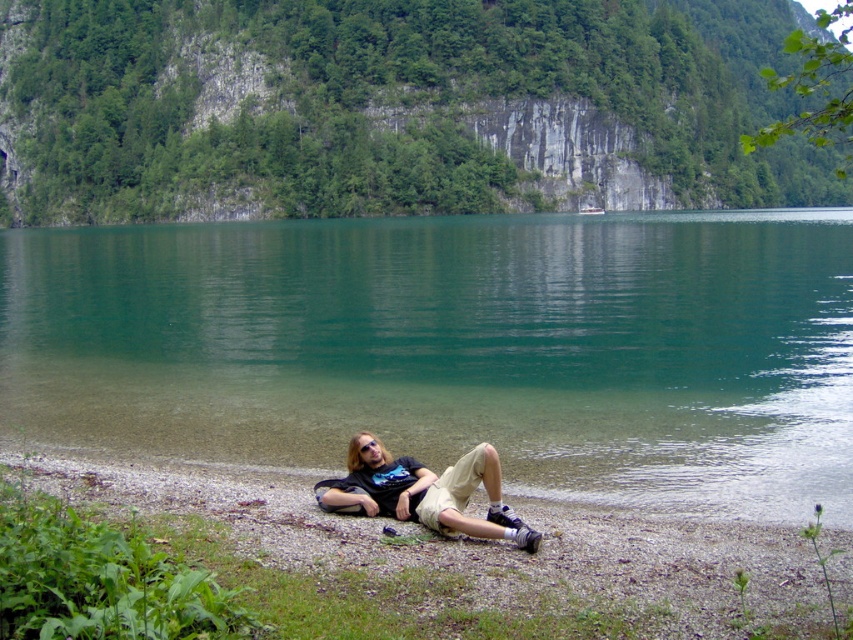
You are standing on the smooth gravel shoreline at lower center and want to reach the green smooth water at center. Which direction should you move to get there?

You should move to the right since the green smooth water at center is located to the right of the smooth gravel shoreline at lower center.